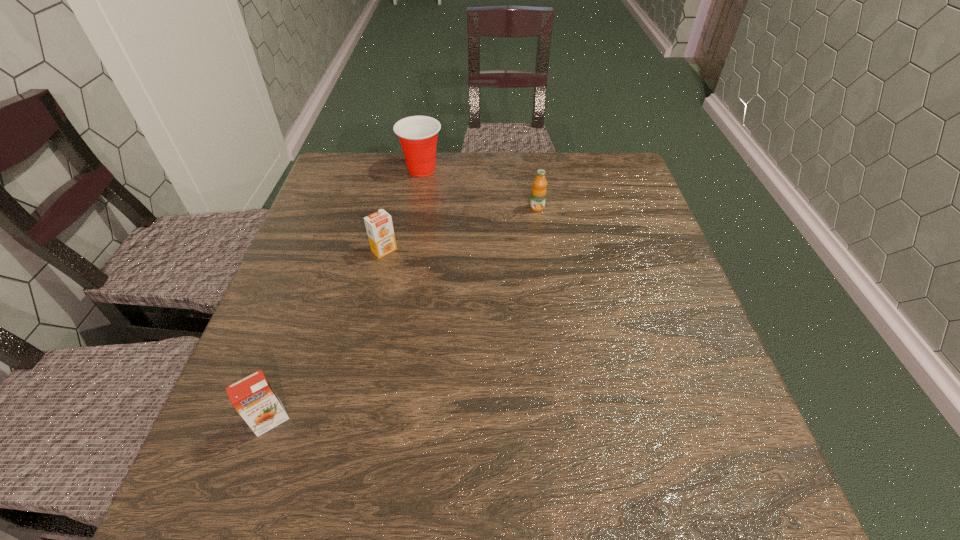
The width and height of the screenshot is (960, 540). I want to click on vacant space located on the back of the leftmost object, so click(x=294, y=352).

This screenshot has height=540, width=960. Find the location of `free space located 0.180m on the back of the second orange juice from left to right`. free space located 0.180m on the back of the second orange juice from left to right is located at coordinates (396, 199).

You are a GUI agent. You are given a task and a screenshot of the screen. Output one action in this format:
    pyautogui.click(x=<x>, y=<y>)
    Task: Click on the object that is at the far edge
    The height and width of the screenshot is (540, 960).
    Given the screenshot: What is the action you would take?
    pyautogui.click(x=418, y=135)

I want to click on object present at the left edge, so click(253, 397).

In order to click on blank area at the far edge in this screenshot , I will do `click(402, 170)`.

In the image, there is a desktop. Where is `free space at the near edge`? The height and width of the screenshot is (540, 960). free space at the near edge is located at coordinates (492, 465).

What are the coordinates of `free region at the left edge of the desktop` in the screenshot? It's located at (287, 325).

Identify the location of vacant space at the right edge of the desktop. (644, 227).

Where is `free space at the far left corner of the desktop`? free space at the far left corner of the desktop is located at coordinates (340, 152).

Find the location of a particular element. The image size is (960, 540). vacant space at the near left corner of the desktop is located at coordinates (240, 483).